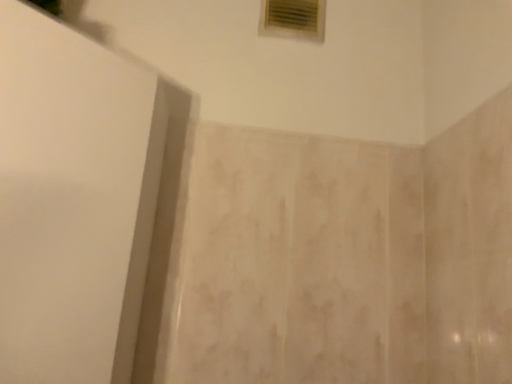
Question: Could white matte screen door at left be considered to be inside white plastic vent at upper center?

Choices:
 (A) no
 (B) yes

Answer: (A)

Question: Is white plastic vent at upper center not near white matte screen door at left?

Choices:
 (A) no
 (B) yes

Answer: (A)

Question: Does white plastic vent at upper center have a smaller size compared to white matte screen door at left?

Choices:
 (A) no
 (B) yes

Answer: (B)

Question: Is white plastic vent at upper center further to the viewer compared to white matte screen door at left?

Choices:
 (A) no
 (B) yes

Answer: (B)

Question: Is white plastic vent at upper center taller than white matte screen door at left?

Choices:
 (A) no
 (B) yes

Answer: (A)

Question: Is white plastic vent at upper center at the left side of white matte screen door at left?

Choices:
 (A) yes
 (B) no

Answer: (B)

Question: From a real-world perspective, is white matte screen door at left physically below white plastic vent at upper center?

Choices:
 (A) no
 (B) yes

Answer: (B)

Question: Is white matte screen door at left bigger than white plastic vent at upper center?

Choices:
 (A) yes
 (B) no

Answer: (A)

Question: Is white matte screen door at left looking in the opposite direction of white plastic vent at upper center?

Choices:
 (A) no
 (B) yes

Answer: (A)

Question: Considering the relative sizes of white matte screen door at left and white plastic vent at upper center in the image provided, is white matte screen door at left wider than white plastic vent at upper center?

Choices:
 (A) yes
 (B) no

Answer: (A)

Question: Does white matte screen door at left come behind white plastic vent at upper center?

Choices:
 (A) yes
 (B) no

Answer: (B)

Question: Is white matte screen door at left outside of white plastic vent at upper center?

Choices:
 (A) yes
 (B) no

Answer: (A)

Question: Considering the positions of white plastic vent at upper center and white matte screen door at left in the image, is white plastic vent at upper center bigger or smaller than white matte screen door at left?

Choices:
 (A) big
 (B) small

Answer: (B)